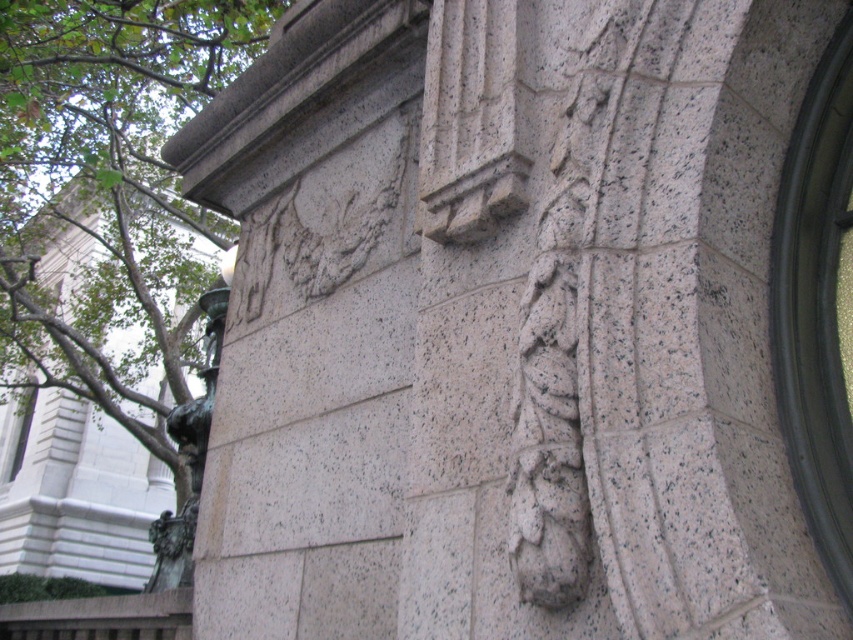
Who is taller, granite carving at center-right or bronze statue at left?

bronze statue at left

Who is more distant from viewer, (538, 484) or (195, 465)?

The point (195, 465) is behind.

Where is `granite carving at center-right`? granite carving at center-right is located at coordinates (555, 369).